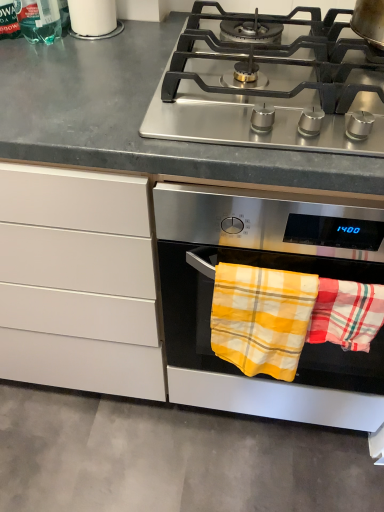
I want to click on vacant area that is situated to the right of translucent green bottle at upper left, so click(x=109, y=48).